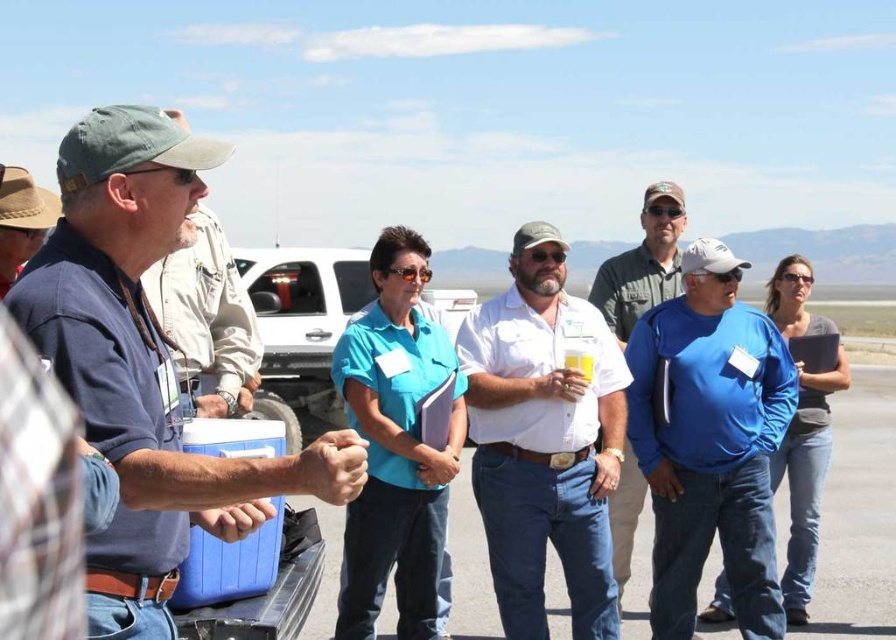
Between white cotton shirt at center and matte khaki hat at left, which one appears on the right side from the viewer's perspective?

From the viewer's perspective, white cotton shirt at center appears more on the right side.

Find the location of a particular element. This screenshot has height=640, width=896. white cotton shirt at center is located at coordinates (544, 440).

Who is lower down, white cotton shirt at center or denim jacket at left?

white cotton shirt at center is below.

Between point (583, 593) and point (221, 396), which one is positioned in front?

Point (221, 396) is in front.

Where is `white cotton shirt at center`? This screenshot has width=896, height=640. white cotton shirt at center is located at coordinates (544, 440).

The height and width of the screenshot is (640, 896). What do you see at coordinates (711, 440) in the screenshot?
I see `blue smooth shirt at center` at bounding box center [711, 440].

Is blue smooth shirt at center below white plastic cooler at center?

Indeed, blue smooth shirt at center is positioned under white plastic cooler at center.

Which is behind, point (717, 516) or point (345, 288)?

The point (345, 288) is behind.

Identify the location of blue smooth shirt at center. (711, 440).